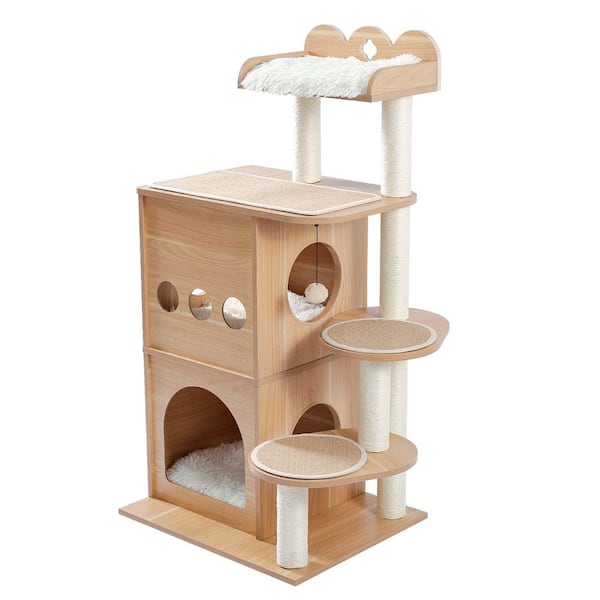
You are a GUI agent. You are given a task and a screenshot of the screen. Output one action in this format:
    pyautogui.click(x=<x>, y=<y>)
    Task: Click on the circular mat
    The width and height of the screenshot is (600, 600).
    Given the screenshot: What is the action you would take?
    pyautogui.click(x=315, y=461), pyautogui.click(x=386, y=328)